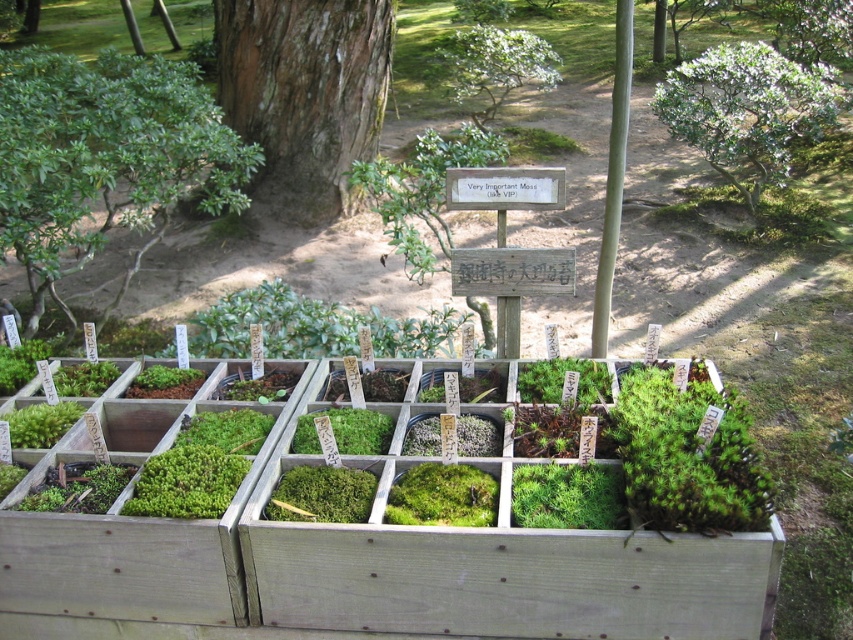
You are a gardener looking at the wooden planter box. You need to determine which plant is shorter between the green leafy shrub at left and the green leafy tree at upper center. Which one is shorter?

The green leafy shrub at left is shorter than the green leafy tree at upper center.

You are standing in front of the wooden planter box and see two points labeled as point (314, 67) and point (552, 65). Which point is nearer to you?

Point (314, 67) is closer to the viewer than point (552, 65).

You are standing in front of the wooden planter box and notice two points marked on the grid. The first point is at coordinate point(177, 99) and the second is at point(465, 100). Which point is closer to you?

Point(177, 99) is in front of point(465, 100), so it is closer to you.